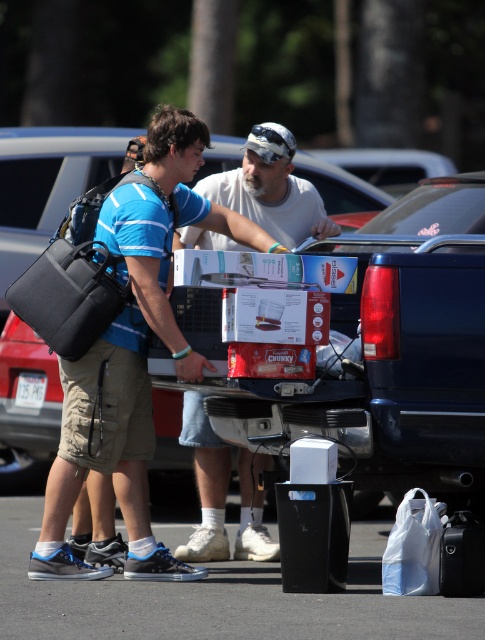
Can you confirm if matte black backpack at left is positioned above white matte shirt at center?

Indeed, matte black backpack at left is positioned over white matte shirt at center.

Does point (60, 516) lie in front of point (289, 166)?

Yes.

Measure the distance between point (188,134) and camera.

10.00 meters

The image size is (485, 640). Find the location of `matte black backpack at left`. matte black backpack at left is located at coordinates (118, 396).

Does red cardboard boxes at center appear under white matte shirt at center?

No, red cardboard boxes at center is not below white matte shirt at center.

What do you see at coordinates (414, 337) in the screenshot?
I see `red cardboard boxes at center` at bounding box center [414, 337].

Find the location of `red cardboard boxes at center`. red cardboard boxes at center is located at coordinates (414, 337).

Can you confirm if red cardboard boxes at center is shorter than matte black backpack at left?

Yes, red cardboard boxes at center is shorter than matte black backpack at left.

Who is shorter, red cardboard boxes at center or matte black backpack at left?

red cardboard boxes at center

Locate an element on the screen. The image size is (485, 640). red cardboard boxes at center is located at coordinates (414, 337).

Locate an element on the screen. red cardboard boxes at center is located at coordinates (414, 337).